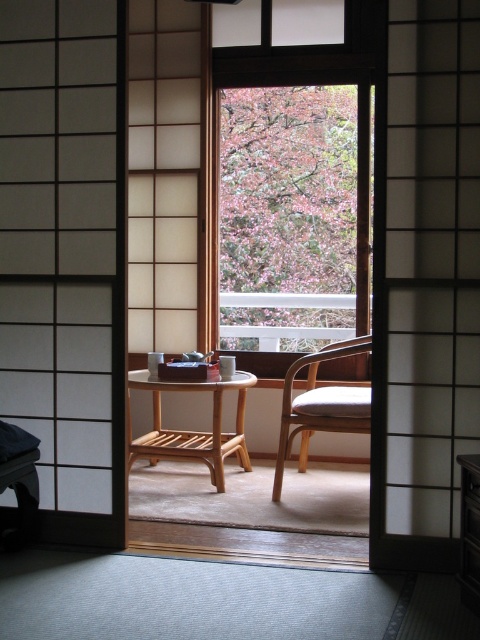
Consider the image. You are standing outside the sliding door and want to place a small potted plant on the light brown wooden table at center. To avoid blocking the view through the transparent glass window at center, which side of the table should you place the plant?

You should place the small potted plant on the left side of the light brown wooden table at center because the transparent glass window at center is on the right side of the table, so placing the plant on the left will keep the window view unobstructed.

You are a delivery person carrying a package that is 1.2 meters long. You need to bring it through the transparent glass window at center into the room where the wooden chair at center is located. Can you fit the package through the window without tilting it?

The transparent glass window at center is 1.03 meters from wooden chair at center. However, the distance between the window and the chair does not indicate the window width. Without knowing the window width, it is impossible to determine if the 1.2 meters long package can fit through without tilting.

You are trying to determine if a decorative mat that is 1.2 meters wide will fit through the opening between the transparent glass window at center and the wooden chair at center. Can it fit?

The transparent glass window at center is wider than the wooden chair at center, but without knowing the exact distance between them, it is impossible to determine if the 1.2 meter wide mat will fit through the opening.